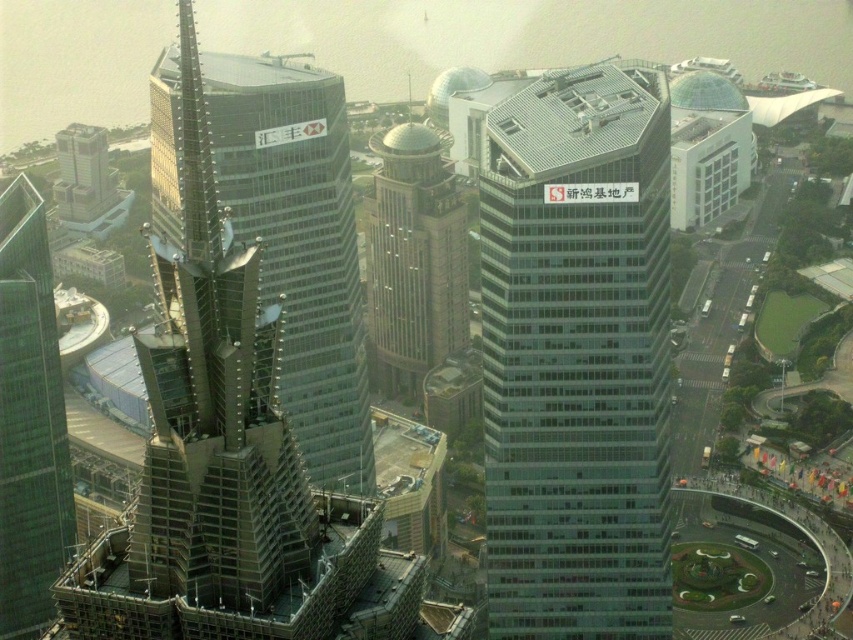
You are a drone operator tasked with flying a drone between the green glass skyscraper at left and the white glass building at upper right. The drone has a maximum flight distance of 300 meters. Can the drone safely make the trip without needing to recharge?

The distance between the green glass skyscraper at left and the white glass building at upper right is 310.46 meters, which exceeds the drone operator maximum flight distance of 300 meters. The drone cannot safely make the trip without needing to recharge.

You are standing in the plaza and want to take a photo of the green glass skyscraper at left and the gold textured dome at center. Which building should you focus on first to ensure both are in frame?

You should focus on the green glass skyscraper at left first because it is closer to you than the gold textured dome at center, so adjusting the camera to include both would require starting with the closer one.

You are a city planner analyzing the urban layout. Given the glassy steel skyscraper at left and the white glass building at upper right, which one has a greater horizontal span when viewed from above?

The glassy steel skyscraper at left has a greater horizontal span than the white glass building at upper right because its width surpasses the latter.